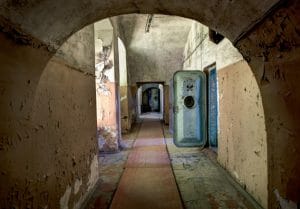
Identify the location of door. (191, 128).